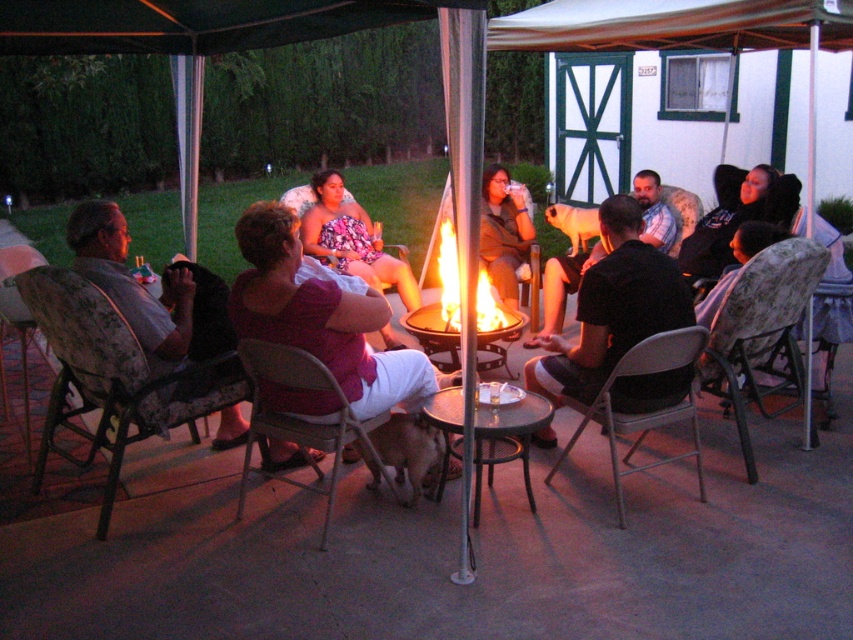
You are standing at the edge of the fire pit and want to hand a marshmallow to both the pink fabric shirt at center and the dark brown shirt at center. Which person should you approach first to ensure you can reach them without moving too far from your current position?

The pink fabric shirt at center is closer to the viewer than the dark brown shirt at center, so you should approach the pink fabric shirt at center first since they are nearer to your current position at the edge of the fire pit.